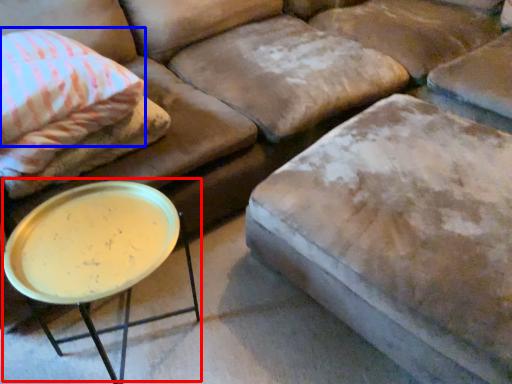
Question: Which object is closer to the camera taking this photo, round table (highlighted by a red box) or pillow (highlighted by a blue box)?

Choices:
 (A) round table
 (B) pillow

Answer: (A)